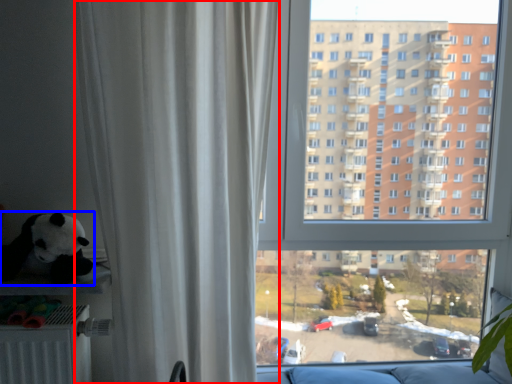
Question: Which of the following is the farthest to the observer, curtain (highlighted by a red box) or toy (highlighted by a blue box)?

Choices:
 (A) curtain
 (B) toy

Answer: (B)